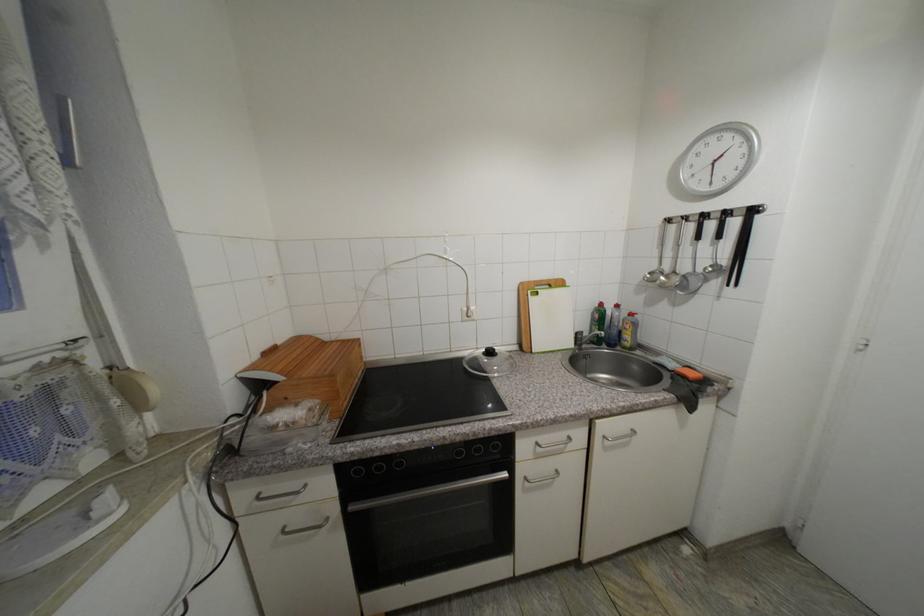
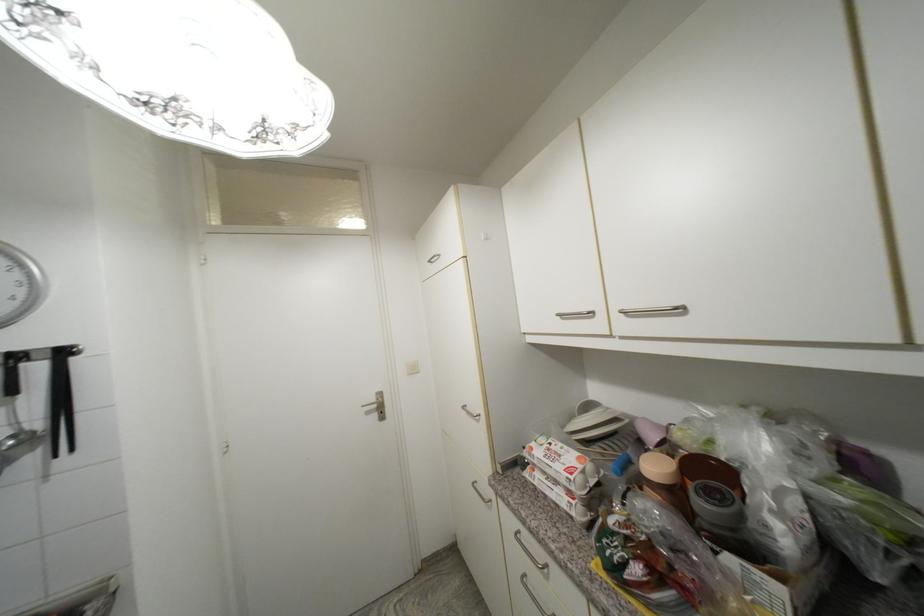
Locate, in the second image, the point that corresponds to (x=733, y=215) in the first image.

(22, 359)